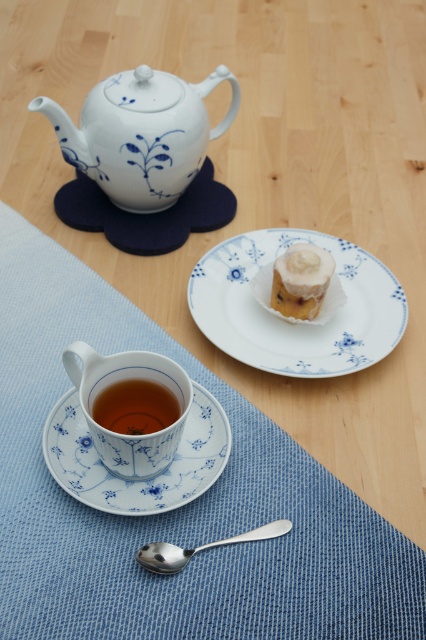
You are setting up a tea service and need to place the white porcelain saucer at lower center and the translucent glass cup at lower center correctly. According to the image, which object should be placed on top of the other?

The white porcelain saucer at lower center is located below the translucent glass cup at lower center, so the translucent glass cup at lower center should be placed on top of the white porcelain saucer at lower center.

You are looking at the tea setting and need to place a small sugar cube. You have two points to choose from on the wooden surface. The first point is at coordinates point (155,440) and the second is at point (284,314). Which point is closer to you where you can place the sugar cube?

Point (155,440) is closer to the viewer than point (284,314), so you should place the sugar cube there.

Looking at this image, you are a tea server standing 1 meter away from the white porcelain saucer at lower center. Can you reach it without moving your feet?

The white porcelain saucer at lower center is 70.95 centimeters away from the viewer. Since you are standing 1 meter away, which is farther than the saucer, you cannot reach it without moving closer.